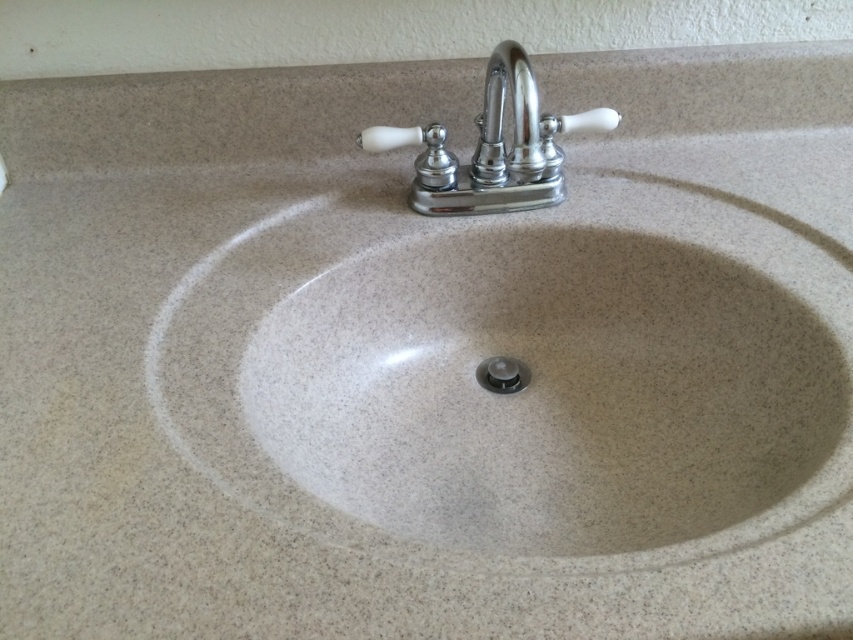
You are standing in front of the bathroom sink area. There is a point labeled at coordinates point (492, 147). What object is located at that point?

The point (492, 147) corresponds to the chrome polished metal faucet at upper center.